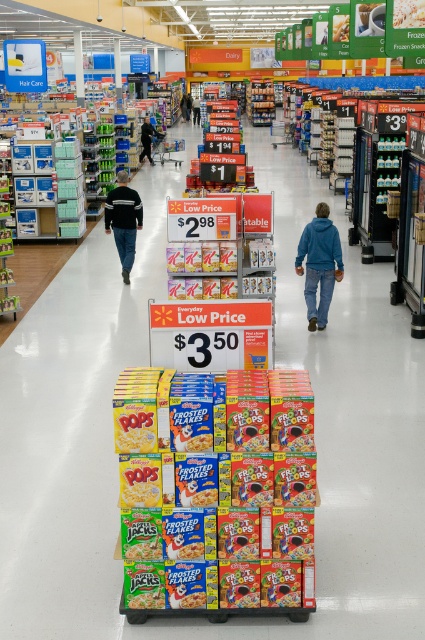
Question: Which of the following is the closest to the observer?

Choices:
 (A) (189, 100)
 (B) (322, 236)
 (C) (150, 156)

Answer: (B)

Question: Can you confirm if blue fleece jacket at center is positioned above black fleece jacket at left?

Choices:
 (A) no
 (B) yes

Answer: (A)

Question: Is blue fleece jacket at center wider than black fleece jacket at left?

Choices:
 (A) no
 (B) yes

Answer: (B)

Question: Does dark blue jeans at center have a lesser width compared to blue fabric jacket at center?

Choices:
 (A) no
 (B) yes

Answer: (A)

Question: Which is nearer to the dark blue jeans at center?

Choices:
 (A) blue fleece jacket at center
 (B) multicolored cardboard frosted flakes at center
 (C) black fleece jacket at left

Answer: (C)

Question: Among these objects, which one is farthest from the camera?

Choices:
 (A) blue fleece jacket at center
 (B) dark blue jeans at center
 (C) black fleece jacket at left

Answer: (B)